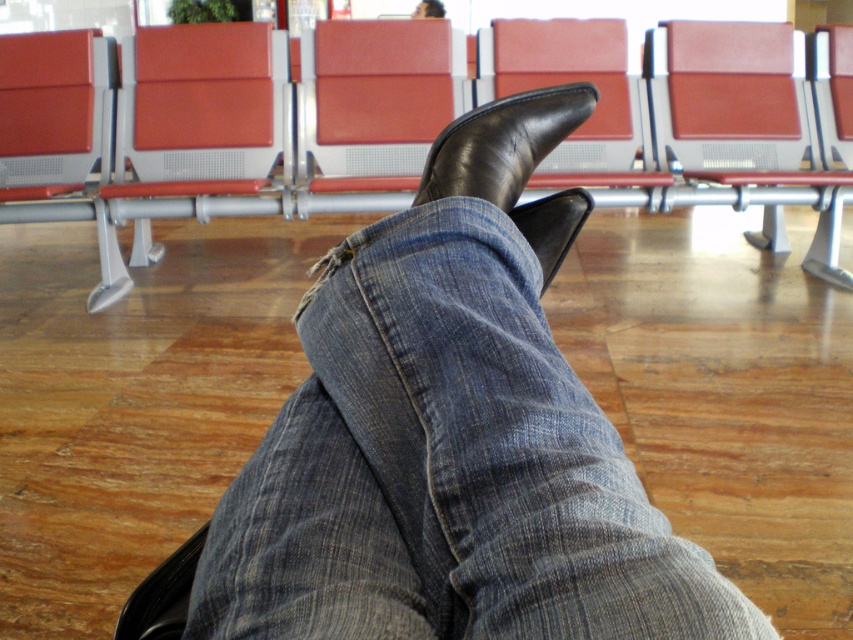
Question: Which of the following is the farthest from the observer?

Choices:
 (A) (44, 45)
 (B) (576, 214)

Answer: (A)

Question: Which of the following is the farthest from the observer?

Choices:
 (A) denim at center
 (B) matte leather chair at center

Answer: (B)

Question: Does leather seat at center lie behind matte leather chair at center?

Choices:
 (A) yes
 (B) no

Answer: (B)

Question: Can you confirm if denim at center is bigger than matte leather chair at center?

Choices:
 (A) yes
 (B) no

Answer: (B)

Question: Is denim at center in front of matte red chair at center?

Choices:
 (A) no
 (B) yes

Answer: (B)

Question: Among these points, which one is farthest from the camera?

Choices:
 (A) (114, 292)
 (B) (500, 81)
 (C) (456, 145)

Answer: (B)